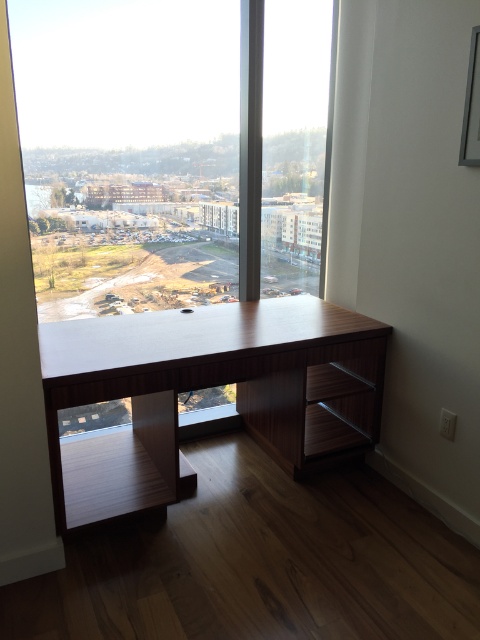
From the picture: You are standing in the modern workspace and want to move from one point to another. The points are labeled as point 1 at coordinates (272,243) and point 2 at coordinates (248,417). Which point is closer to you when you are facing the desk?

Point 1 at coordinates (272,243) is closer to you because it is further to the viewer than point 2 at coordinates (248,417).

You are a delivery person who needs to place a package on the desk. You are currently standing in front of the transparent glass window at center. Which direction should you move to reach the wooden desk at center?

The wooden desk at center is behind the transparent glass window at center, so you should move backward to reach it.